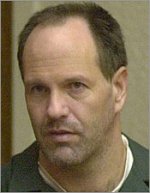
This screenshot has height=193, width=150. What are the coordinates of `wood frame` in the screenshot? It's located at (6, 123).